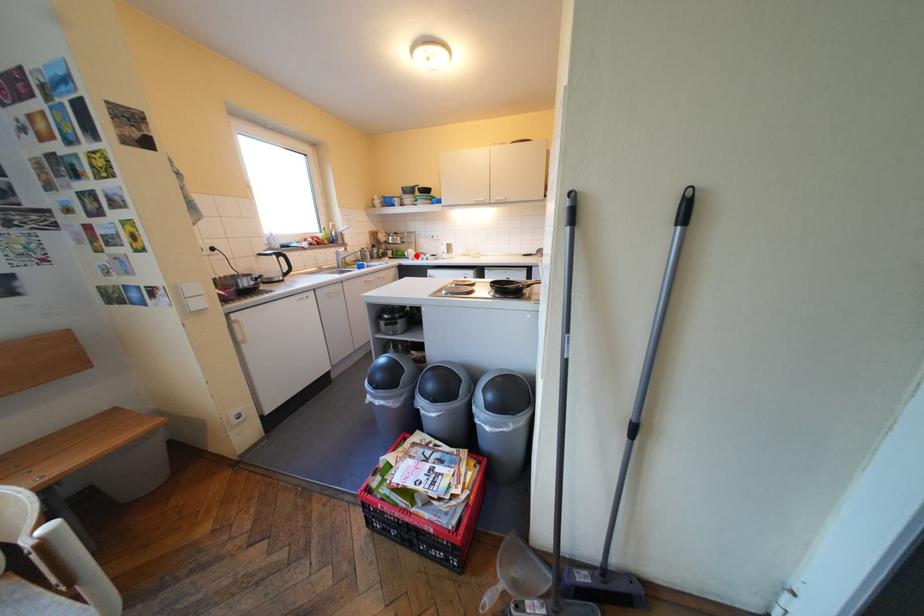
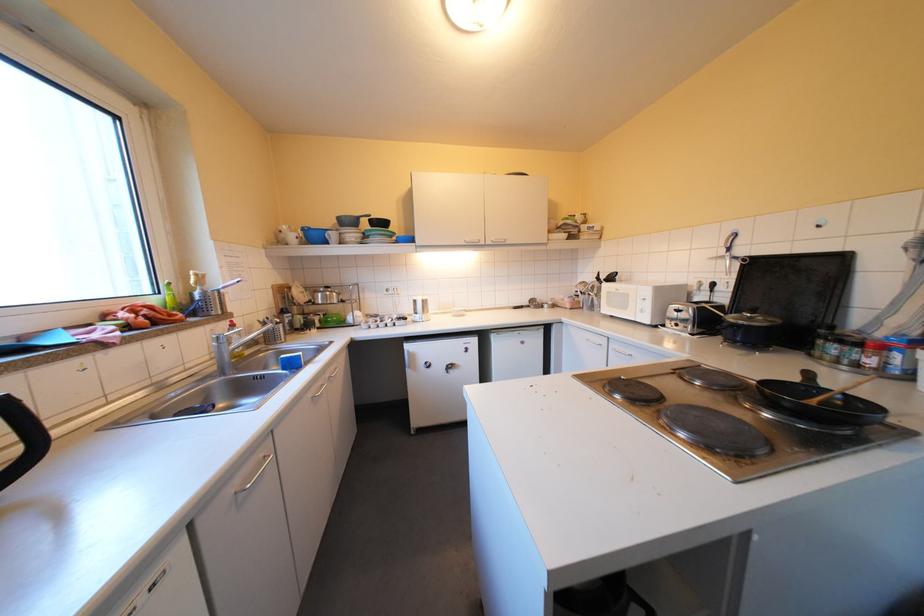
Question: I am providing you with two images of the same scene from different viewpoints. A red point is shown in image1. For the corresponding object point in image2, is it positioned nearer or farther from the camera?

Choices:
 (A) Nearer
 (B) Farther

Answer: (B)